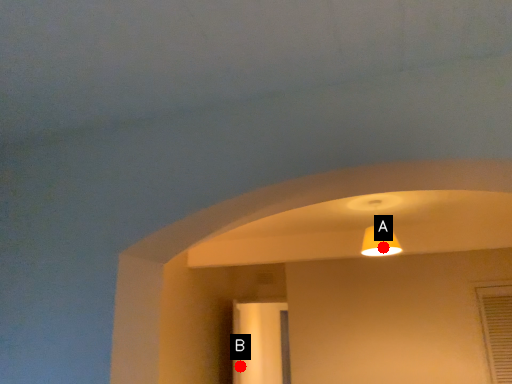
Question: Two points are circled on the image, labeled by A and B beside each circle. Which point appears closest to the camera in this image?

Choices:
 (A) A is closer
 (B) B is closer

Answer: (A)